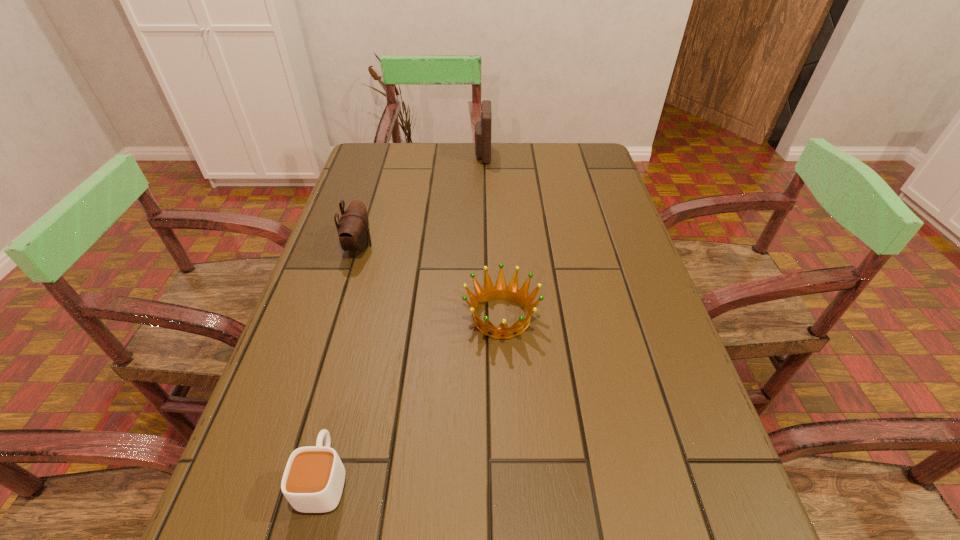
Find the location of a particular element. The width and height of the screenshot is (960, 540). free spot that satisfies the following two spatial constraints: 1. on the side with the handle of the crown; 2. on the left side of the nearest object is located at coordinates (364, 317).

At what (x,y) coordinates should I click in order to perform the action: click on free location that satisfies the following two spatial constraints: 1. with an open flap on the third farthest object; 2. on the left side of the farthest object. Please return your answer as a coordinate pair (x, y). Looking at the image, I should click on (484, 317).

Locate an element on the screen. Image resolution: width=960 pixels, height=540 pixels. vacant area in the image that satisfies the following two spatial constraints: 1. on the side with the handle of the cup; 2. with the flap open on the left pouch is located at coordinates (382, 246).

Identify the location of free space that satisfies the following two spatial constraints: 1. on the side with the handle of the cup; 2. on the left side of the crown. This screenshot has height=540, width=960. (364, 317).

You are a GUI agent. You are given a task and a screenshot of the screen. Output one action in this format:
    pyautogui.click(x=<x>, y=<y>)
    Task: Click on the free region that satisfies the following two spatial constraints: 1. on the side with the handle of the nearest object; 2. on the left side of the third farthest object
    This screenshot has width=960, height=540.
    Given the screenshot: What is the action you would take?
    pyautogui.click(x=364, y=317)